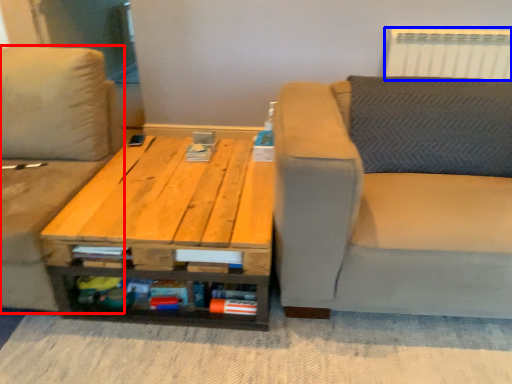
Question: Which point is further to the camera, studio couch (highlighted by a red box) or radiator (highlighted by a blue box)?

Choices:
 (A) studio couch
 (B) radiator

Answer: (B)